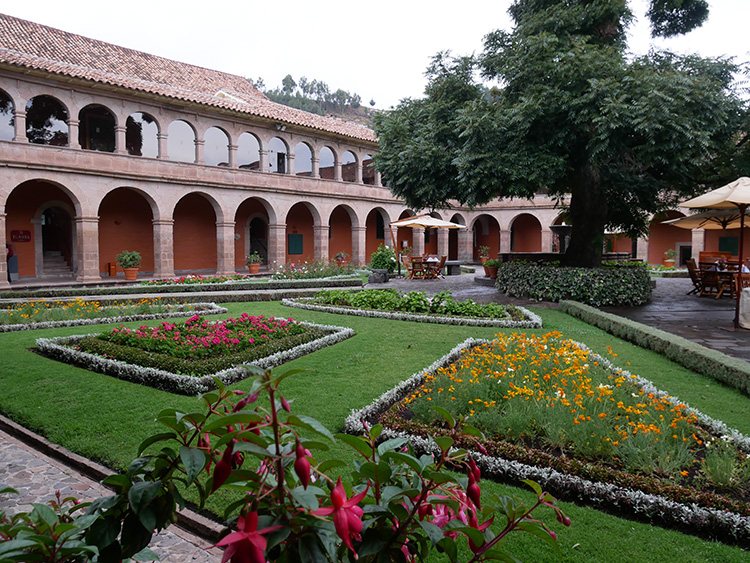
Find the location of `chairs`. chairs is located at coordinates (706, 283), (691, 272).